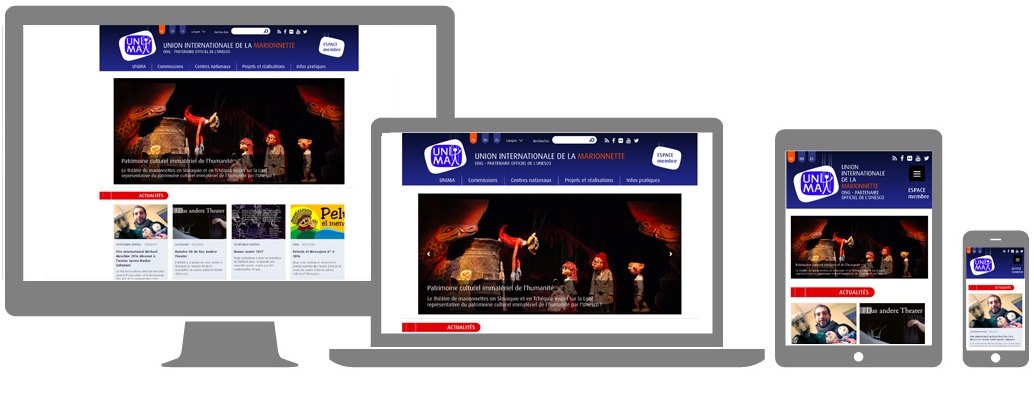
Find the location of `tablet screen`. tablet screen is located at coordinates (910, 287).